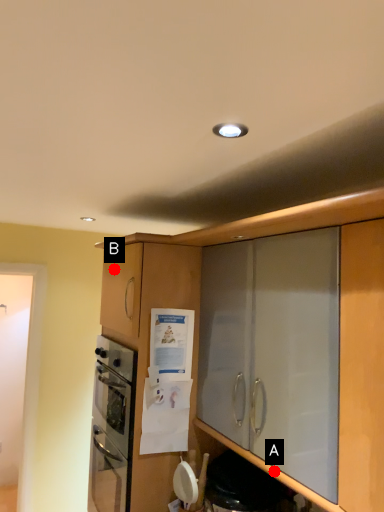
Question: Two points are circled on the image, labeled by A and B beside each circle. Which point is farther from the camera taking this photo?

Choices:
 (A) A is further
 (B) B is further

Answer: (B)